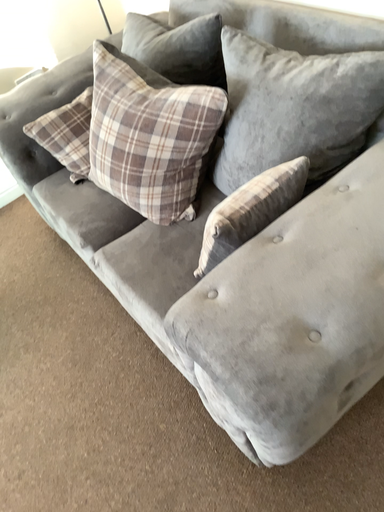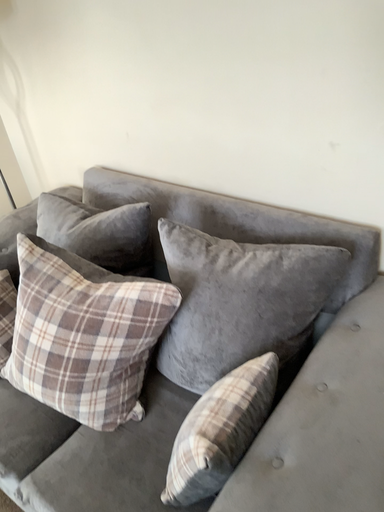
Question: Which way did the camera rotate in the video?

Choices:
 (A) rotated right
 (B) rotated left

Answer: (A)